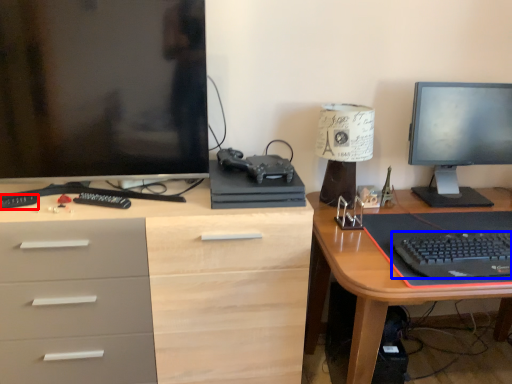
Question: Among these objects, which one is nearest to the camera, remote control (highlighted by a red box) or computer keyboard (highlighted by a blue box)?

Choices:
 (A) remote control
 (B) computer keyboard

Answer: (B)